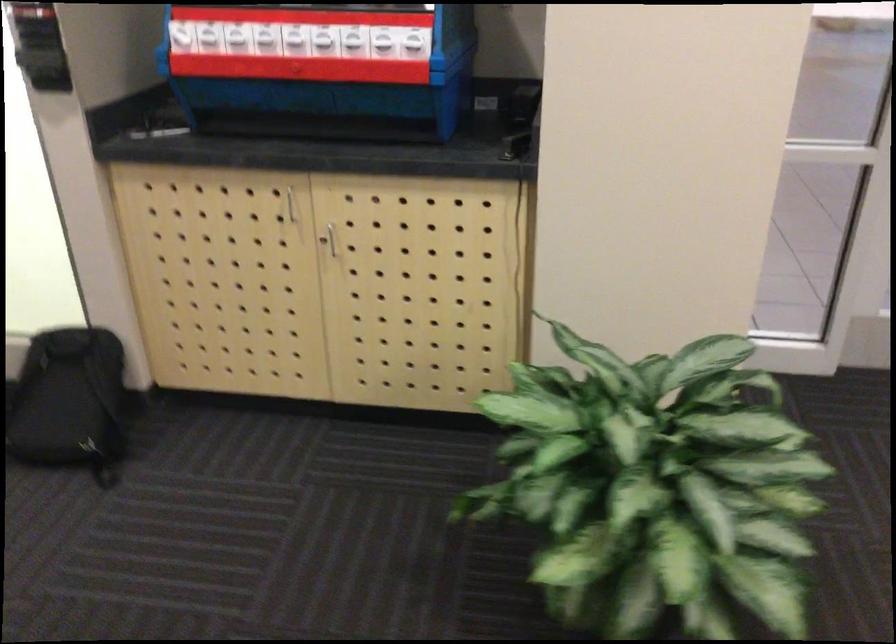
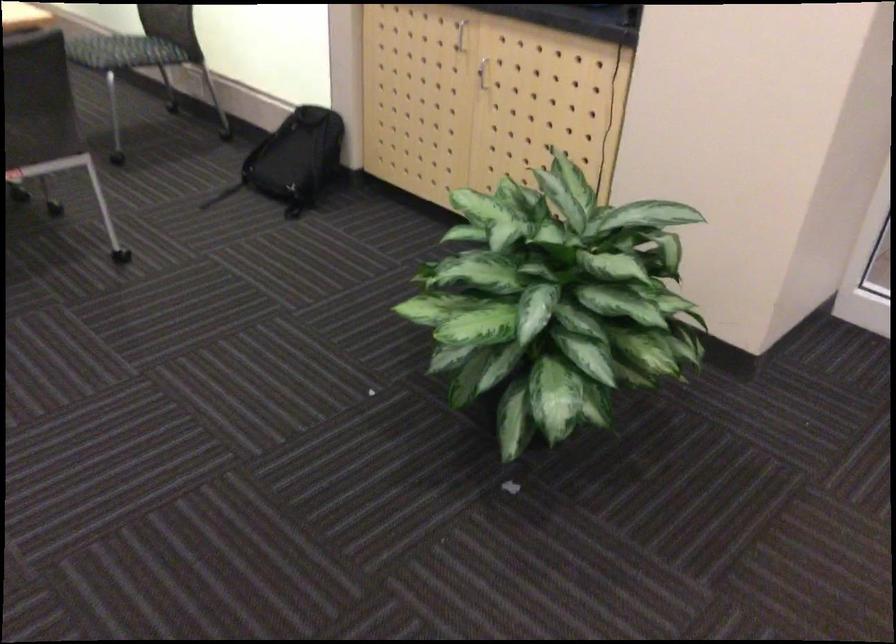
Locate, in the second image, the point that corresponds to point 340,242 in the first image.

(483, 73)